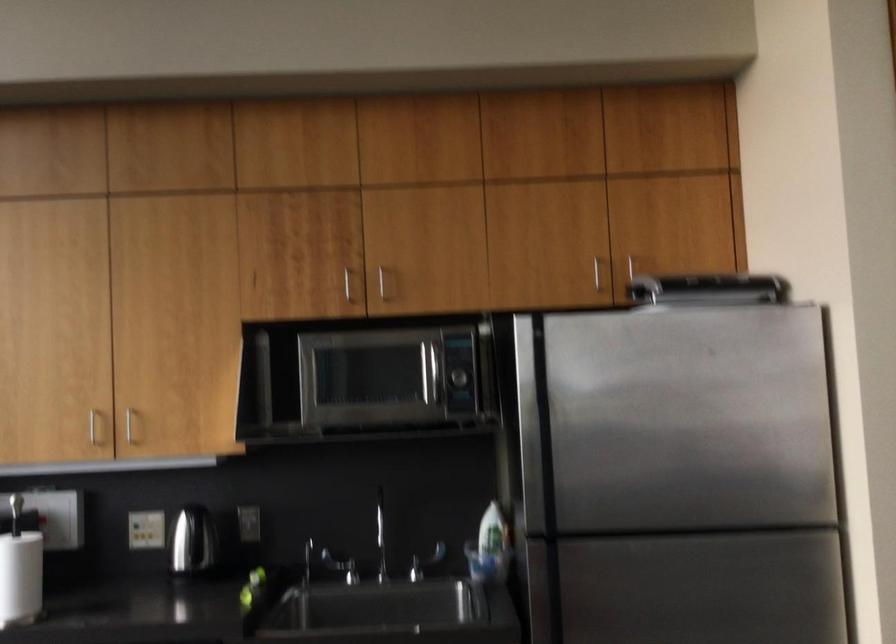
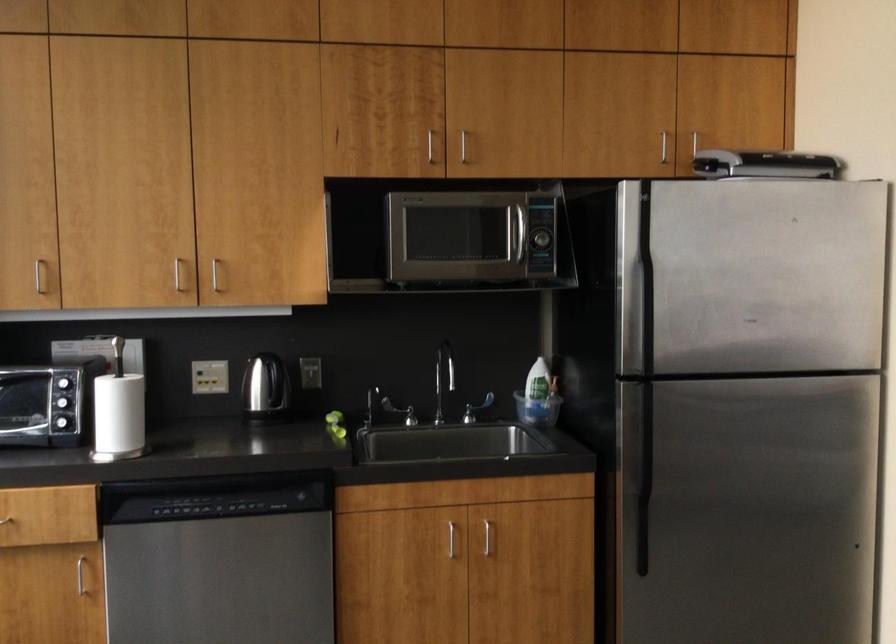
The point at (629,266) is marked in the first image. Where is the corresponding point in the second image?

(694, 143)